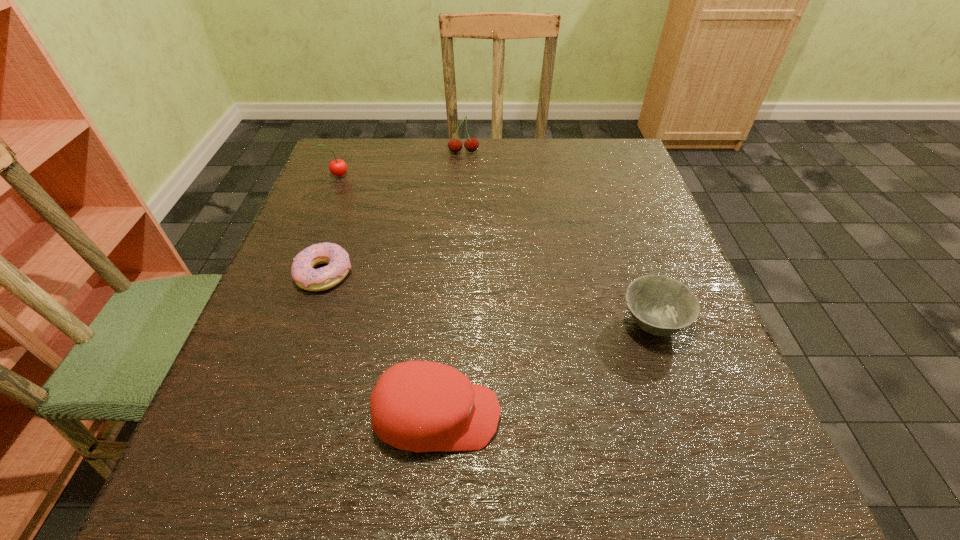
In order to click on free region at the near edge in this screenshot , I will do [626, 475].

In the image, there is a desktop. In order to click on free region at the left edge in this screenshot , I will do `click(298, 234)`.

You are a GUI agent. You are given a task and a screenshot of the screen. Output one action in this format:
    pyautogui.click(x=<x>, y=<y>)
    Task: Click on the vacant space at the right edge of the desktop
    
    Given the screenshot: What is the action you would take?
    pyautogui.click(x=668, y=234)

Locate an element on the screen. free space at the far left corner is located at coordinates (383, 167).

In the image, there is a desktop. Where is `free space at the far right corner`? The width and height of the screenshot is (960, 540). free space at the far right corner is located at coordinates (612, 152).

At what (x,y) coordinates should I click in order to perform the action: click on vacant area between the third nearest object and the right cherry. Please return your answer as a coordinate pair (x, y). Looking at the image, I should click on (394, 213).

This screenshot has width=960, height=540. I want to click on blank region between the right cherry and the nearer cherry, so click(400, 164).

Where is `vacant space that's between the right cherry and the nearest object`? The height and width of the screenshot is (540, 960). vacant space that's between the right cherry and the nearest object is located at coordinates (450, 284).

The width and height of the screenshot is (960, 540). I want to click on empty space that is in between the second shortest object and the nearer cherry, so click(x=495, y=249).

You are a GUI agent. You are given a task and a screenshot of the screen. Output one action in this format:
    pyautogui.click(x=<x>, y=<y>)
    Task: Click on the empty space between the farthest object and the third farthest object
    The width and height of the screenshot is (960, 540).
    Given the screenshot: What is the action you would take?
    pyautogui.click(x=394, y=213)